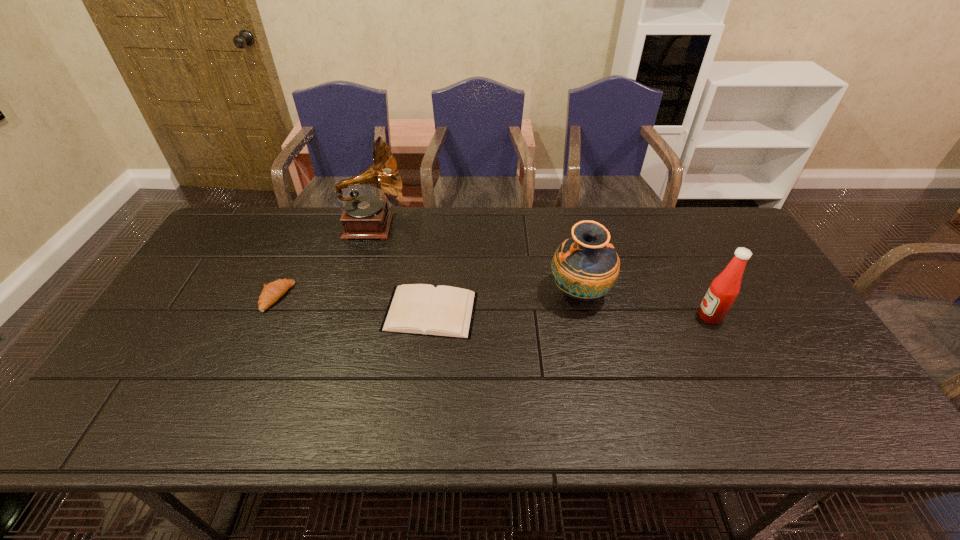
The image size is (960, 540). In order to click on empty location between the leftmost object and the condiment in this screenshot , I will do `click(493, 307)`.

Choose which object is the third nearest neighbor to the hardback book. Please provide its 2D coordinates. Your answer should be formatted as a tuple, i.e. [(x, y)], where the tuple contains the x and y coordinates of a point satisfying the conditions above.

[(273, 291)]

Identify which object is the third closest to the rightmost object. Please provide its 2D coordinates. Your answer should be formatted as a tuple, i.e. [(x, y)], where the tuple contains the x and y coordinates of a point satisfying the conditions above.

[(365, 217)]

Where is `blank space that satisfies the following two spatial constraints: 1. on the horn of the hardback book; 2. on the left side of the tallest object`? The width and height of the screenshot is (960, 540). blank space that satisfies the following two spatial constraints: 1. on the horn of the hardback book; 2. on the left side of the tallest object is located at coordinates (349, 312).

This screenshot has width=960, height=540. I want to click on vacant space that satisfies the following two spatial constraints: 1. on the front side of the shortest object; 2. on the right side of the leftmost object, so click(x=270, y=312).